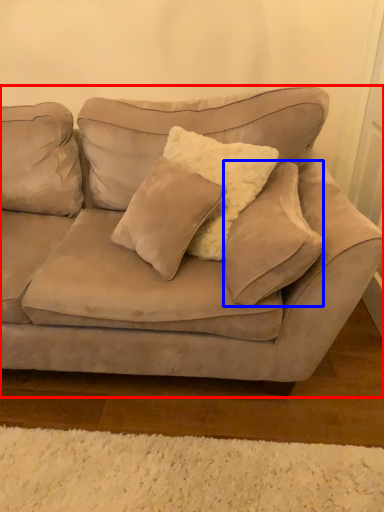
Question: Among these objects, which one is farthest to the camera, studio couch (highlighted by a red box) or pillow (highlighted by a blue box)?

Choices:
 (A) studio couch
 (B) pillow

Answer: (B)